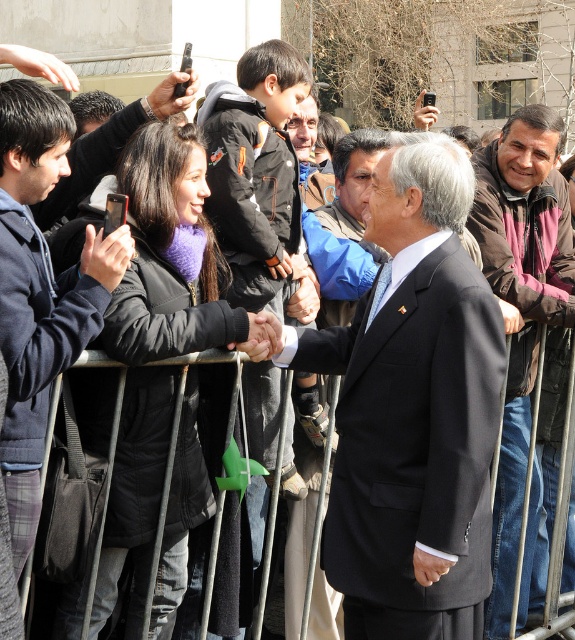
You are a photographer at a public event and need to capture a clear photo of both the navy blue jacket at center and the brown leather jacket at center. Since the jackets are at the same center position, which one is taller and would be easier to frame in your shot?

The navy blue jacket at center is taller than the brown leather jacket at center, so it would be easier to frame in the shot.

You are a photographer at a public event where the man in a dark suit is shaking hands with a woman in a black jacket. You notice the brown leather jacket at center and the black plastic phone at upper center. Which object is closer to the photographer?

The brown leather jacket at center is closer to the photographer because the black plastic phone at upper center is behind it.